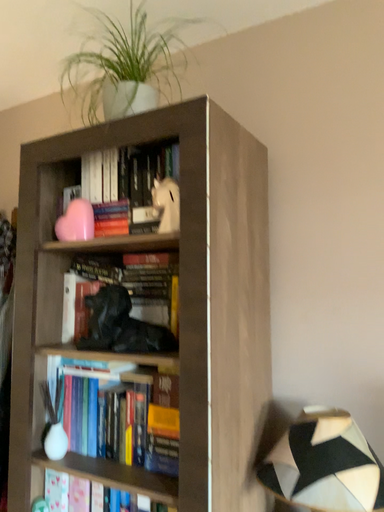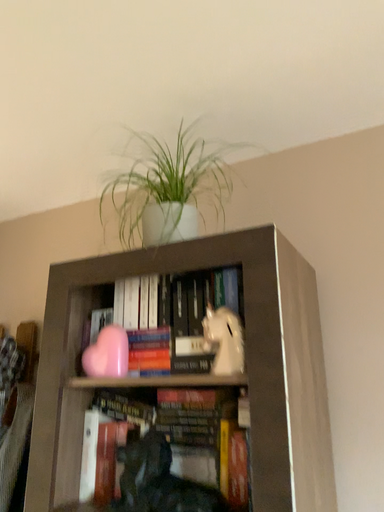
Question: How did the camera likely rotate when shooting the video?

Choices:
 (A) rotated downward
 (B) rotated upward

Answer: (B)